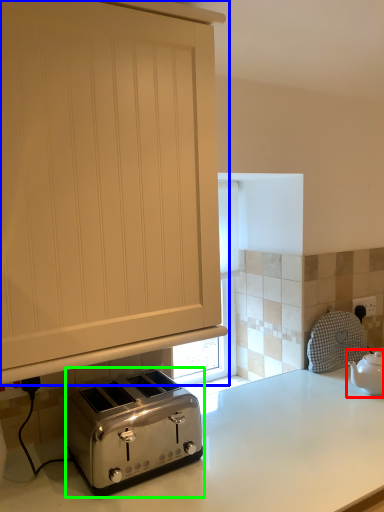
Question: Estimate the real-world distances between objects in this image. Which object is closer to tea pot (highlighted by a red box), cabinetry (highlighted by a blue box) or toaster (highlighted by a green box)?

Choices:
 (A) cabinetry
 (B) toaster

Answer: (B)